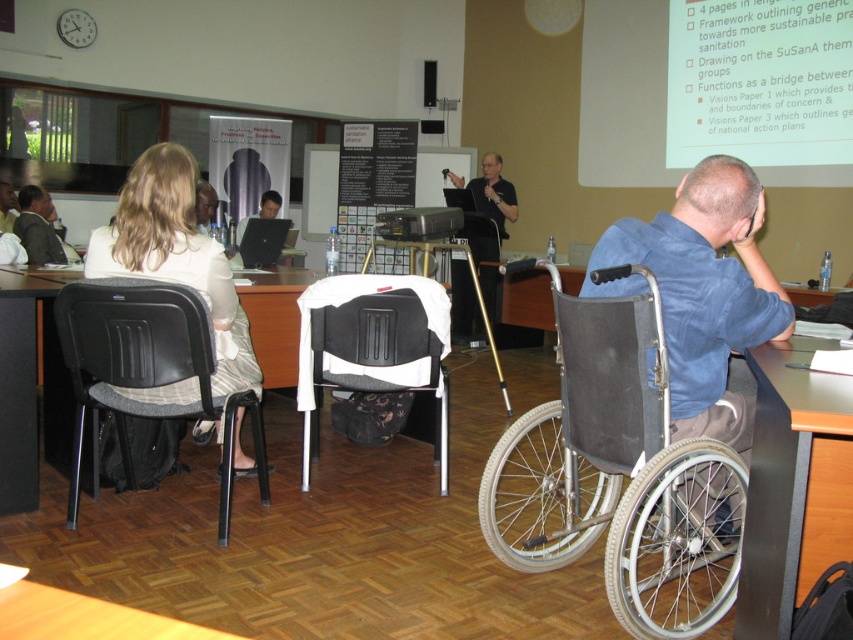
You are organizing a seminar and want to ensure accessibility for all attendees. There is a person in a wheelchair at the front facing the presentation. You need to move a black plastic chair at left to make space. Which direction should you move it to avoid blocking the view of the black fabric shirt at center?

The black plastic chair at left should be moved to the right side of the black fabric shirt at center since the black plastic chair at left is currently on the left side of the black fabric shirt at center, moving it to the right would keep it out of the way without blocking the view.

You are a person in a wheelchair trying to watch the presentation. The wheelchair is 1.5 meters wide. Can you move from your current position next to the white matte projection screen at upper right to the black plastic chair at center without needing to turn sideways?

The distance between the white matte projection screen at upper right and the black plastic chair at center is 4.41 meters. Since the wheelchair is 1.5 meters wide, moving straight would require at least 1.5 meters of space. The distance provided is sufficient, so yes, you can move without turning sideways as long as the path is clear.

You are organizing a seminar and need to ensure accessibility for attendees in wheelchairs. The room has a wheelchair located at point [618,474]. Is there enough space for a wheelchair user to maneuver comfortably around this area?

The point [618,474] corresponds to the silver metallic wheelchair at right, so there is sufficient space for a wheelchair user to maneuver around this area.